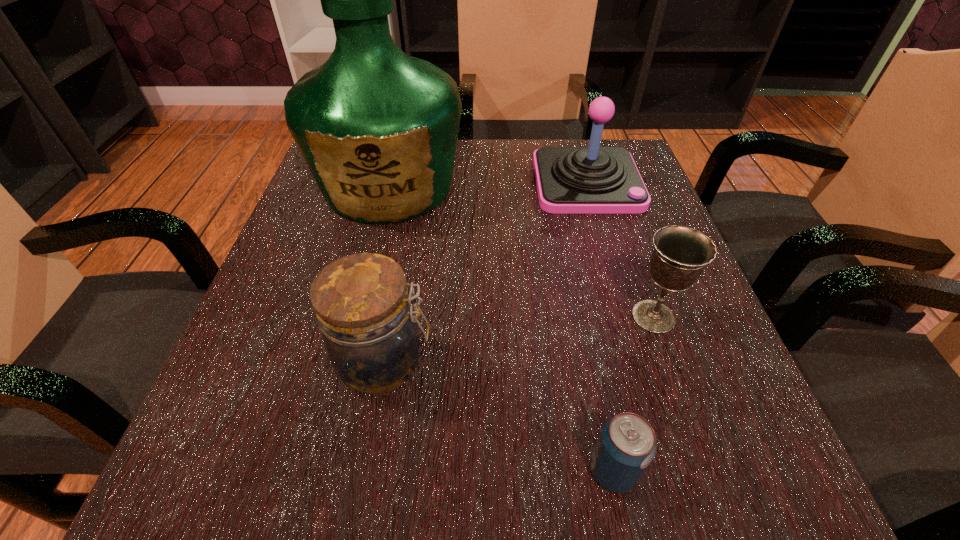
Locate an element on the screen. vacant space that's between the chalice and the joystick is located at coordinates (620, 249).

The height and width of the screenshot is (540, 960). I want to click on free space between the pop soda and the chalice, so click(633, 394).

Where is `empty space that is in between the tallest object and the joystick`? Image resolution: width=960 pixels, height=540 pixels. empty space that is in between the tallest object and the joystick is located at coordinates (488, 184).

Where is `free space between the joystick and the jar`? This screenshot has width=960, height=540. free space between the joystick and the jar is located at coordinates (486, 272).

Where is `the fourth closest object relative to the chalice`? The width and height of the screenshot is (960, 540). the fourth closest object relative to the chalice is located at coordinates (378, 129).

Find the location of a particular element. The image size is (960, 540). object that is the fourth closest to the pop soda is located at coordinates (570, 180).

You are a GUI agent. You are given a task and a screenshot of the screen. Output one action in this format:
    pyautogui.click(x=<x>, y=<y>)
    Task: Click on the free space that satisfies the following two spatial constraints: 1. on the label side of the chalice; 2. on the left side of the liquor
    This screenshot has height=540, width=960.
    Given the screenshot: What is the action you would take?
    pyautogui.click(x=357, y=316)

At what (x,y) coordinates should I click in order to perform the action: click on vacant space that satisfies the following two spatial constraints: 1. forward from the base of the joystick; 2. on the lid of the jar. Please return your answer as a coordinate pair (x, y). Looking at the image, I should click on (639, 362).

The width and height of the screenshot is (960, 540). Identify the location of free point that satisfies the following two spatial constraints: 1. on the front side of the chalice; 2. on the lid of the jar. (669, 362).

Where is `vacant space that satisfies the following two spatial constraints: 1. forward from the base of the joystick; 2. on the left side of the chalice`? vacant space that satisfies the following two spatial constraints: 1. forward from the base of the joystick; 2. on the left side of the chalice is located at coordinates 627,316.